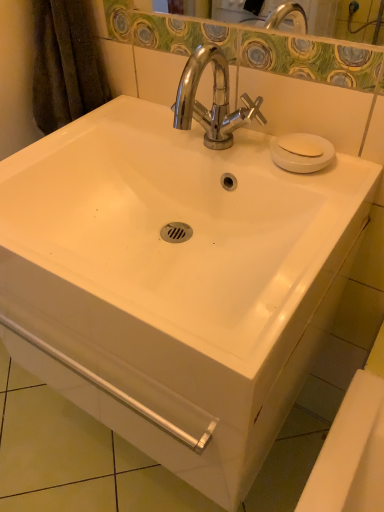
The height and width of the screenshot is (512, 384). I want to click on free space to the left of white matte soap at upper right, so click(x=235, y=146).